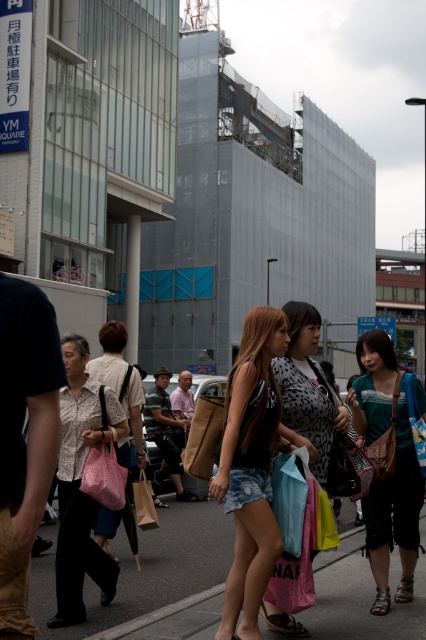
You are a delivery person standing on the sidewalk and need to place a package on the ground. Where should you put it so that it stays near the matte white blouse at center but still rests on the smooth asphalt pavement at lower center?

Place the package on the smooth asphalt pavement at lower center to the right of the matte white blouse at center.

You are a photographer trying to capture a clear shot of the matte white blouse at center without the denim shorts at center blocking it. What adjustment should you make to your camera angle?

Since the denim shorts at center is in front of the matte white blouse at center, you should adjust your camera angle to look behind the denim shorts at center to capture the matte white blouse at center without obstruction.